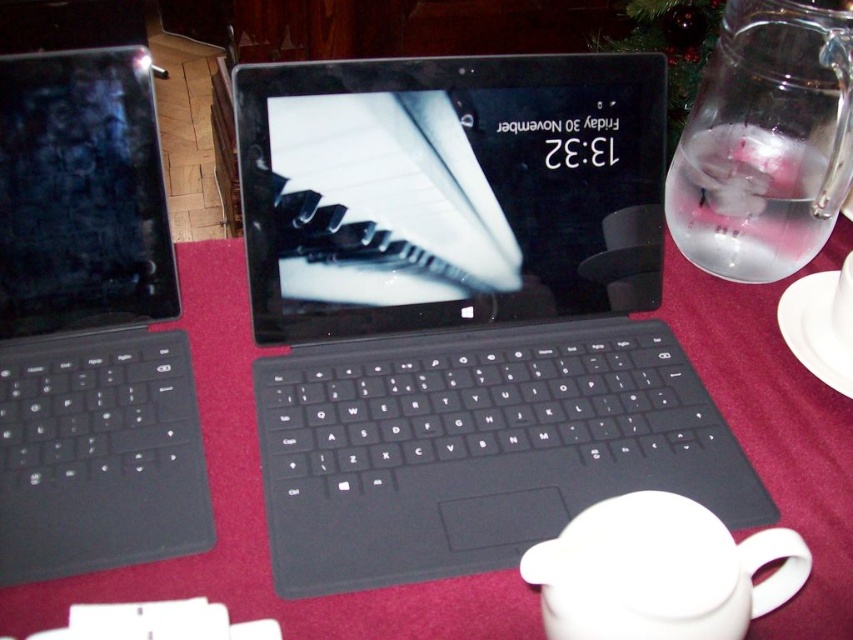
You are setting up a small office space and need to place both the black matte keyboard at center and the white matte mug at lower right on a shelf. The shelf has a width of 50 cm. If the keyboard takes up 30 cm of space, will the mug fit alongside it?

The black matte keyboard at center is bigger than the white matte mug at lower right. Since the keyboard occupies 30 cm of the 50 cm shelf, there remains 20 cm of space. The mug, being smaller, should fit in the remaining space.

You are setting up a presentation and need to place a 10cm wide remote control between the black matte keyboard at center and the white matte mug at lower right. Can the remote fit between them?

The black matte keyboard at center might be wider than white matte mug at lower right, so the distance between them is uncertain. The remote control might not fit.